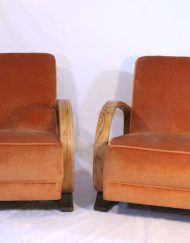
Find the location of `darken wooden chair legs`. darken wooden chair legs is located at coordinates (65, 203), (102, 206).